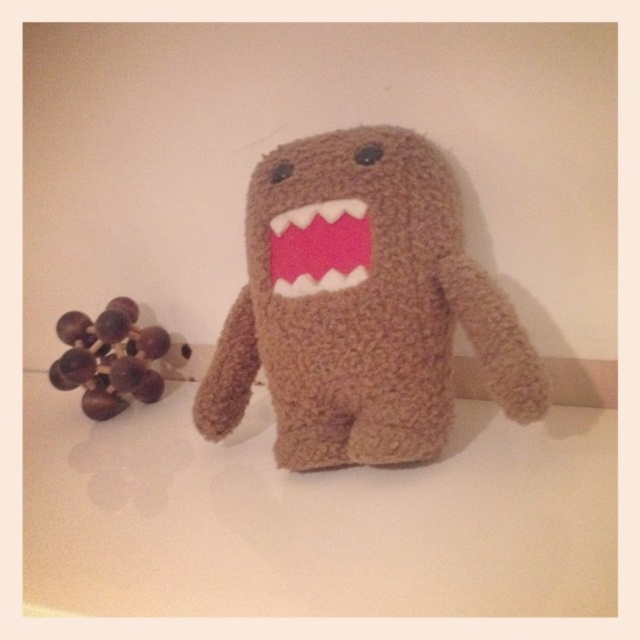
Is fuzzy brown plush toy at center wider than brown fuzzy ball at left?

Correct, the width of fuzzy brown plush toy at center exceeds that of brown fuzzy ball at left.

Does point (410, 192) lie in front of point (67, 320)?

Yes, point (410, 192) is closer to viewer.

What are the coordinates of `fuzzy brown plush toy at center` in the screenshot? It's located at (360, 305).

Who is positioned more to the left, brown fuzzy ball at left or pink felt mouth at center?

brown fuzzy ball at left is more to the left.

Can you confirm if brown fuzzy ball at left is smaller than pink felt mouth at center?

Incorrect, brown fuzzy ball at left is not smaller in size than pink felt mouth at center.

Which is in front, point (60, 320) or point (349, 214)?

Positioned in front is point (349, 214).

Image resolution: width=640 pixels, height=640 pixels. What are the coordinates of `brown fuzzy ball at left` in the screenshot? It's located at (109, 358).

What do you see at coordinates (360, 305) in the screenshot?
I see `fuzzy brown plush toy at center` at bounding box center [360, 305].

Is point (298, 164) closer to viewer compared to point (282, 273)?

Yes, it is in front of point (282, 273).

Locate an element on the screen. fuzzy brown plush toy at center is located at coordinates (360, 305).